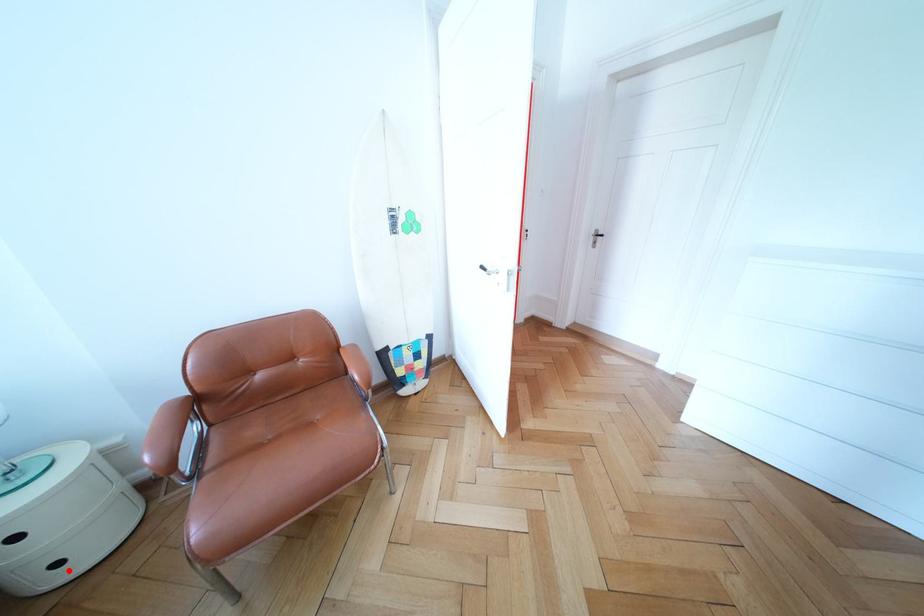
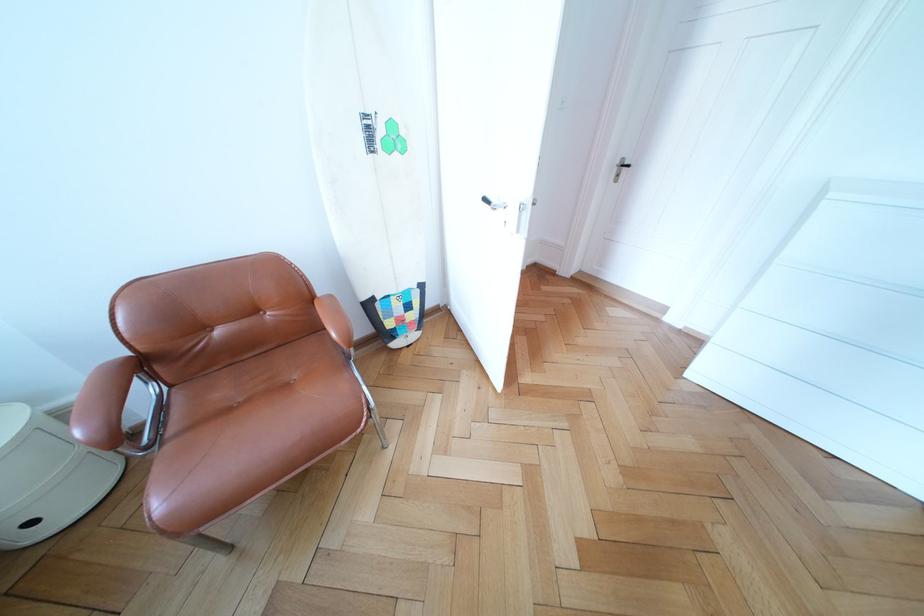
The point at the highlighted location is marked in the first image. Where is the corresponding point in the second image?

(43, 529)